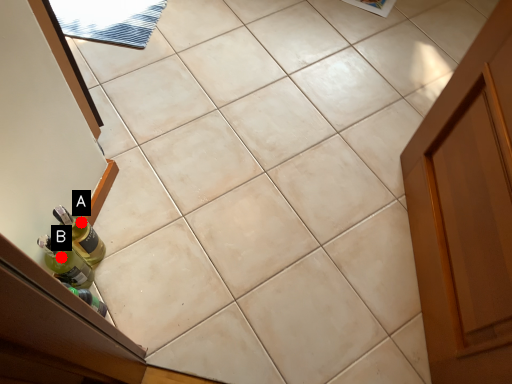
Question: Two points are circled on the image, labeled by A and B beside each circle. Which point is closer to the camera taking this photo?

Choices:
 (A) A is closer
 (B) B is closer

Answer: (A)